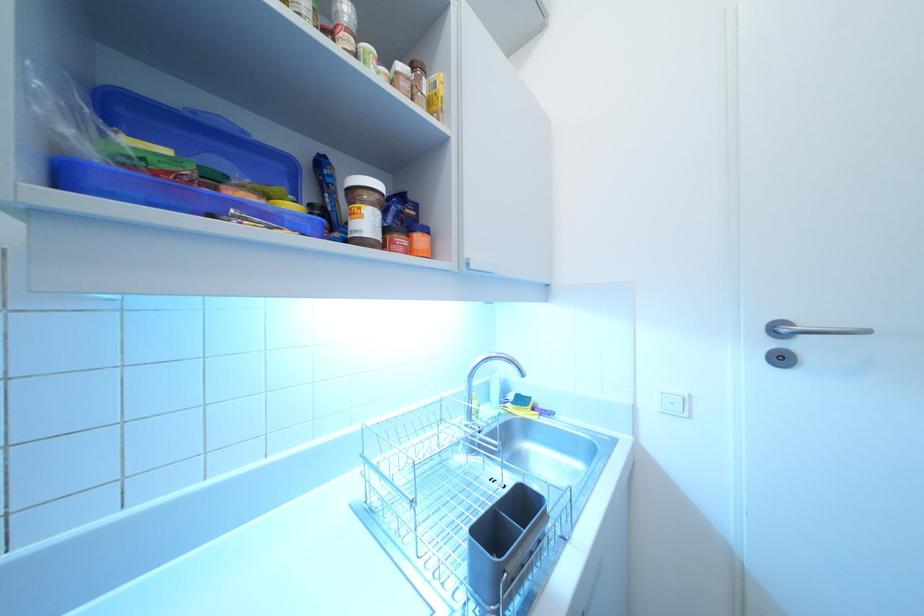
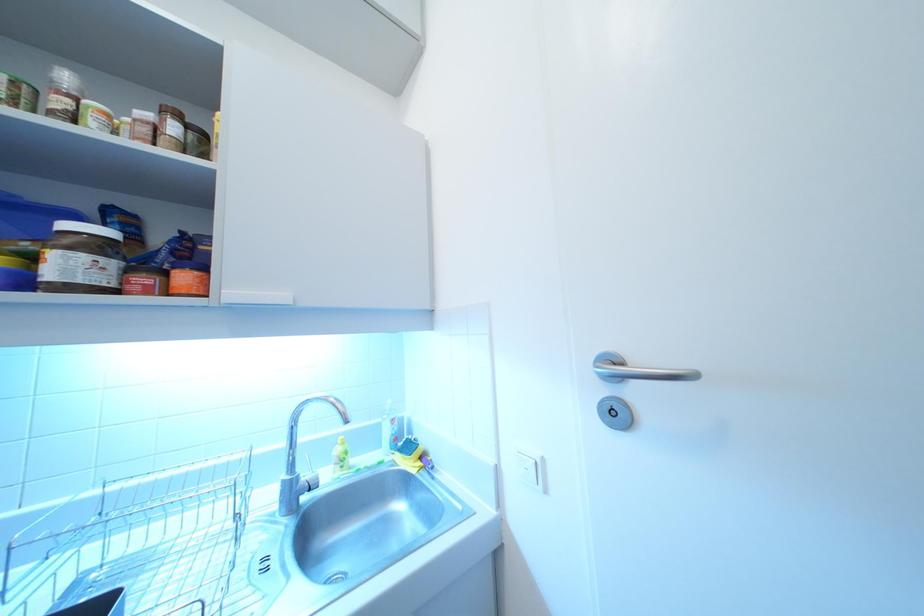
Question: How did the camera likely rotate?

Choices:
 (A) Left
 (B) Right
 (C) Up
 (D) Down

Answer: (A)